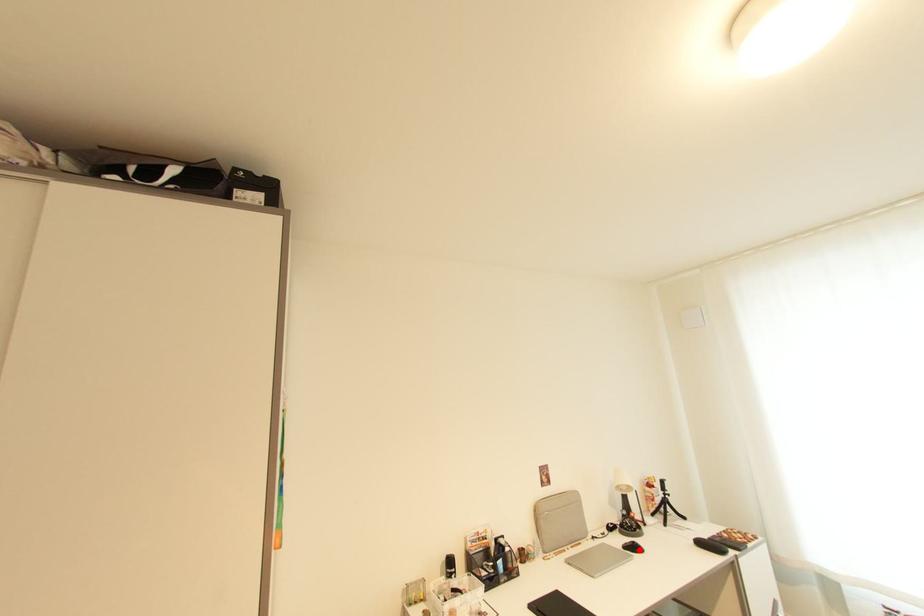
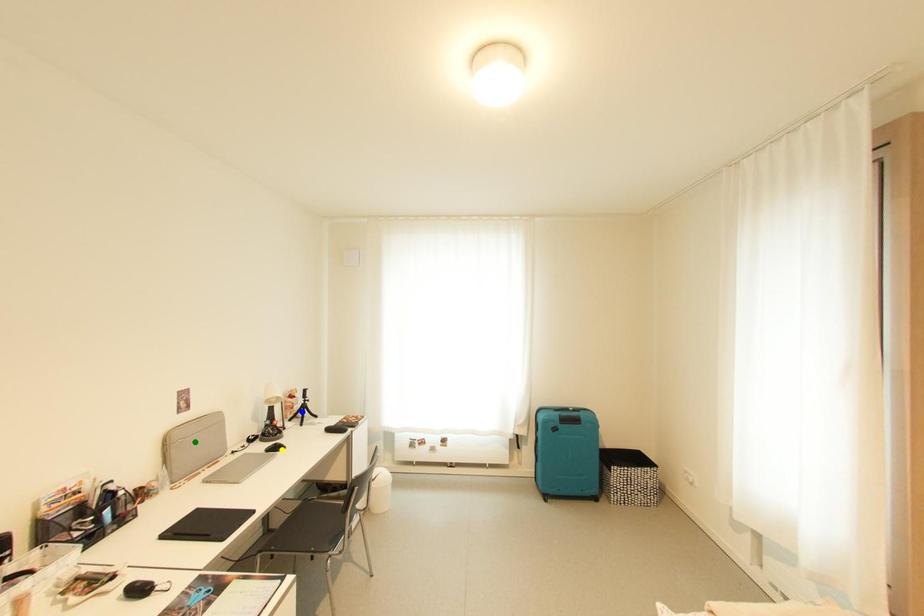
Question: I am providing you with two images of the same scene from different viewpoints. A red point is marked on the first image. You are given multiple points on the second image. Which spot in image 2 lines up with the point in image 1?

Choices:
 (A) green point
 (B) yellow point
 (C) blue point

Answer: (B)